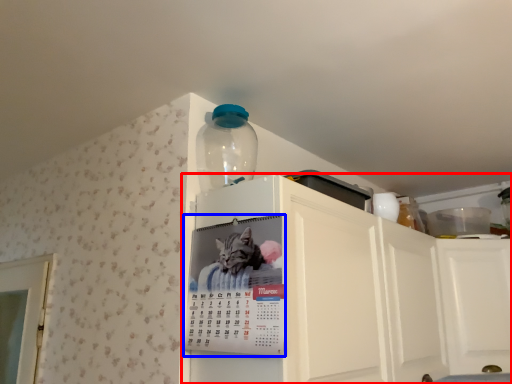
Question: Among these objects, which one is nearest to the camera, cabinetry (highlighted by a red box) or poster (highlighted by a blue box)?

Choices:
 (A) cabinetry
 (B) poster

Answer: (A)